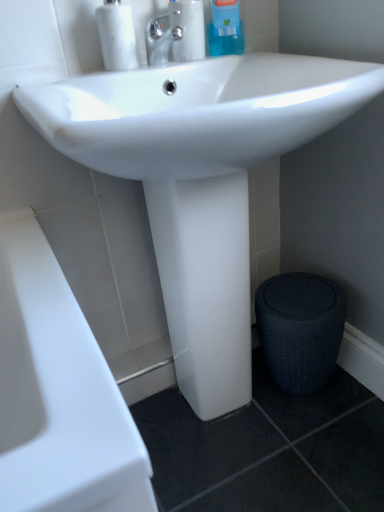
Question: Is textured dark gray stool at lower right situated inside clear plastic bottle at upper center, which is counted as the 2th cleaning product, starting from the right, or outside?

Choices:
 (A) inside
 (B) outside

Answer: (B)

Question: From the image's perspective, relative to clear plastic bottle at upper center, which is the 1th cleaning product from left to right, is textured dark gray stool at lower right above or below?

Choices:
 (A) below
 (B) above

Answer: (A)

Question: Based on their relative distances, which object is nearer to the white marble soap dispenser at upper left?

Choices:
 (A) clear plastic bottle at upper center, which is the 1th cleaning product from left to right
 (B) textured dark gray stool at lower right
 (C) blue glossy bottle at upper center, which is counted as the first cleaning product, starting from the right
 (D) polished chrome faucet at upper center

Answer: (D)

Question: Which is farther from the textured dark gray stool at lower right?

Choices:
 (A) polished chrome faucet at upper center
 (B) blue glossy bottle at upper center, which is counted as the first cleaning product, starting from the right
 (C) clear plastic bottle at upper center, which is counted as the 2th cleaning product, starting from the right
 (D) white marble soap dispenser at upper left

Answer: (D)